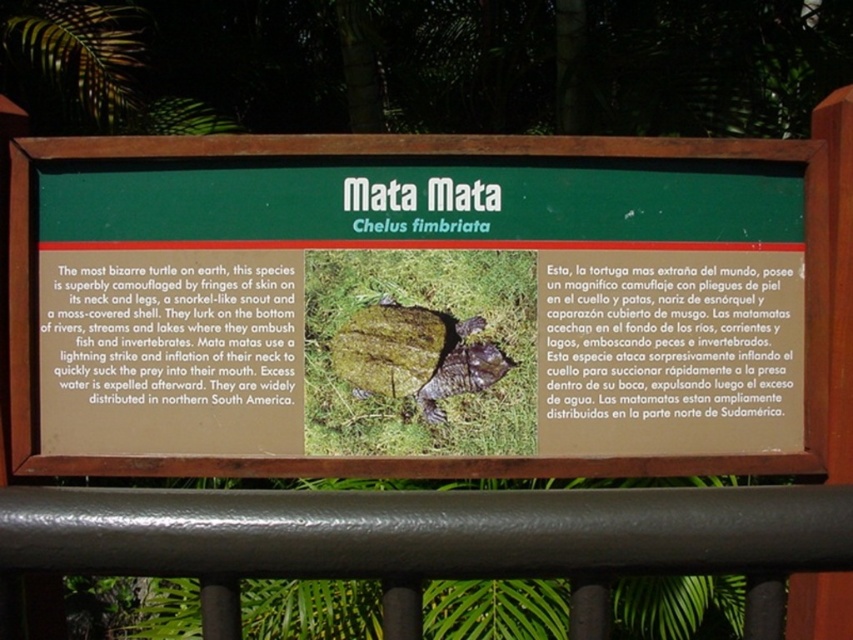
Based on the photo, where is the green matte turtle at center located on the signboard?

The green matte turtle at center is located at point (422, 248) on the signboard.